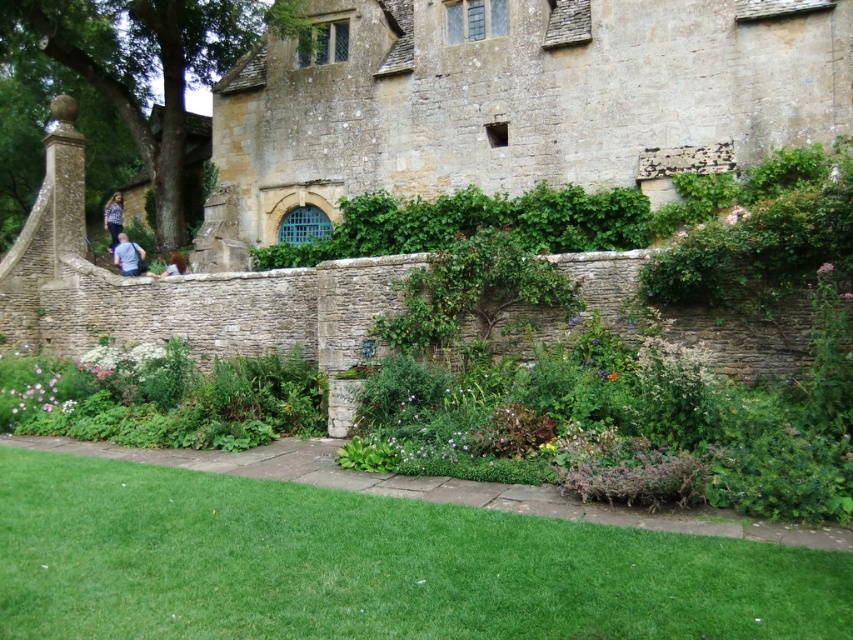
Is point (445, 588) more distant than point (113, 227)?

That is False.

Who is more distant from viewer, (184, 596) or (120, 204)?

The point (120, 204) is behind.

At what (x,y) coordinates should I click in order to perform the action: click on green grass at lower center. Please return your answer as a coordinate pair (x, y). The width and height of the screenshot is (853, 640). Looking at the image, I should click on (369, 564).

Which is below, denim jacket at upper left or light brown hair at center?

light brown hair at center is lower down.

Is denim jacket at upper left positioned in front of light brown hair at center?

No, denim jacket at upper left is behind light brown hair at center.

Who is more forward, (112, 230) or (184, 268)?

Point (184, 268)

Where is `denim jacket at upper left`? denim jacket at upper left is located at coordinates (113, 218).

Which of these two, light blue shirt at upper left or denim jacket at upper left, stands shorter?

light blue shirt at upper left

Consider the image. Is light blue shirt at upper left positioned at the back of denim jacket at upper left?

No, light blue shirt at upper left is in front of denim jacket at upper left.

Does point (122, 269) come in front of point (113, 236)?

Yes, it is.

I want to click on light blue shirt at upper left, so click(126, 256).